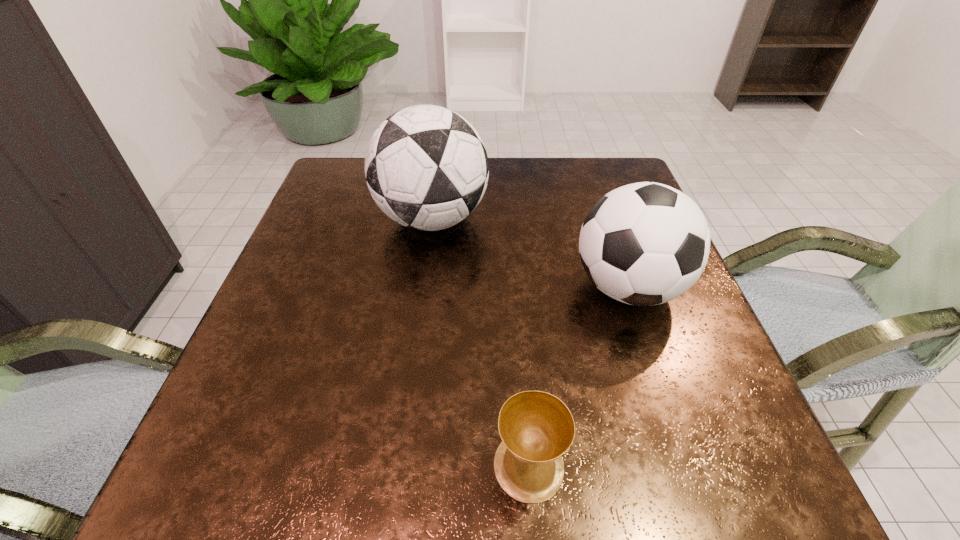
This screenshot has height=540, width=960. In order to click on vacant space that satisfies the following two spatial constraints: 1. on the surface of the rightmost object where the brand logo is visible; 2. on the right side of the leftmost object in this screenshot , I will do point(423,287).